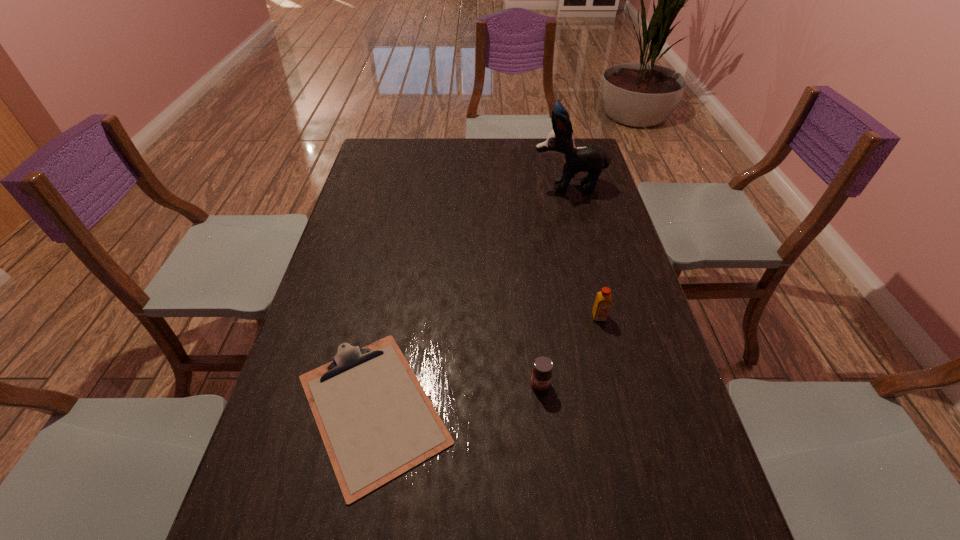
Where is `puppy`? This screenshot has height=540, width=960. puppy is located at coordinates (x=590, y=158).

Locate an element on the screen. Image resolution: width=960 pixels, height=540 pixels. the tallest object is located at coordinates (590, 158).

This screenshot has height=540, width=960. Identify the location of the second farthest object. (603, 300).

Locate an element on the screen. This screenshot has width=960, height=540. the second tallest object is located at coordinates (603, 300).

At what (x,y) coordinates should I click in order to perform the action: click on jam. Please return your answer as a coordinate pair (x, y). The height and width of the screenshot is (540, 960). Looking at the image, I should click on (541, 377).

Where is `the third object from right to left`? the third object from right to left is located at coordinates (541, 377).

Where is `the shortest object`? the shortest object is located at coordinates (376, 421).

This screenshot has width=960, height=540. In order to click on the leftmost object in this screenshot , I will do `click(376, 421)`.

I want to click on vacant space located on the front-facing side of the puppy, so click(471, 185).

The height and width of the screenshot is (540, 960). I want to click on vacant position located on the front-facing side of the puppy, so click(438, 185).